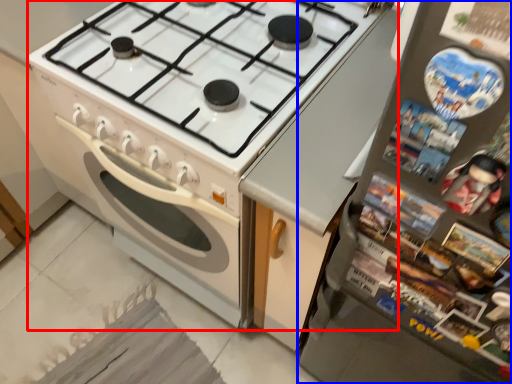
Question: Which of the following is the farthest to the observer, appliance (highlighted by a red box) or refrigerator (highlighted by a blue box)?

Choices:
 (A) appliance
 (B) refrigerator

Answer: (A)